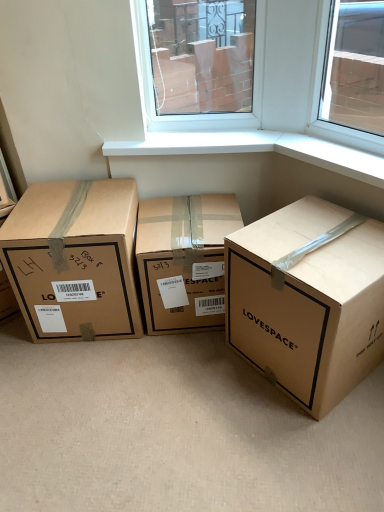
The width and height of the screenshot is (384, 512). Identify the location of brown cardboard box at center, acting as the first box starting from the right. (307, 302).

Describe the element at coordinates (184, 260) in the screenshot. I see `brown cardboard box at center, which is counted as the 2th box, starting from the left` at that location.

Image resolution: width=384 pixels, height=512 pixels. What are the coordinates of `brown cardboard box at left, acting as the first box starting from the left` in the screenshot? It's located at (74, 259).

Is brown cardboard box at center, acting as the first box starting from the right, at the back of brown cardboard box at left, marked as the third box in a right-to-left arrangement?

brown cardboard box at left, marked as the third box in a right-to-left arrangement, does not have its back to brown cardboard box at center, acting as the first box starting from the right.

How much distance is there between brown cardboard box at left, marked as the third box in a right-to-left arrangement, and brown cardboard box at center, which is the third box in left-to-right order?

brown cardboard box at left, marked as the third box in a right-to-left arrangement, is 25.31 inches away from brown cardboard box at center, which is the third box in left-to-right order.

I want to click on box that is above the brown cardboard box at center, acting as the first box starting from the right (from a real-world perspective), so click(74, 259).

From a real-world perspective, is brown cardboard box at left, marked as the third box in a right-to-left arrangement, on top of brown cardboard box at center, which is the third box in left-to-right order?

Yes, from a real-world perspective, brown cardboard box at left, marked as the third box in a right-to-left arrangement, is on top of brown cardboard box at center, which is the third box in left-to-right order.

In the image, is brown cardboard box at left, marked as the third box in a right-to-left arrangement, on the left side or the right side of brown cardboard box at center, the 2th box from the right?

In the image, brown cardboard box at left, marked as the third box in a right-to-left arrangement, appears on the left side of brown cardboard box at center, the 2th box from the right.

Looking at this image, is brown cardboard box at left, acting as the first box starting from the left, outside of brown cardboard box at center, the 2th box from the right?

brown cardboard box at left, acting as the first box starting from the left, is positioned outside brown cardboard box at center, the 2th box from the right.

Can you confirm if brown cardboard box at left, acting as the first box starting from the left, is bigger than brown cardboard box at center, which is counted as the 2th box, starting from the left?

Yes, brown cardboard box at left, acting as the first box starting from the left, is bigger than brown cardboard box at center, which is counted as the 2th box, starting from the left.

Considering the relative sizes of brown cardboard box at center, which is the third box in left-to-right order, and brown cardboard box at left, marked as the third box in a right-to-left arrangement, in the image provided, is brown cardboard box at center, which is the third box in left-to-right order, shorter than brown cardboard box at left, marked as the third box in a right-to-left arrangement,?

Yes, brown cardboard box at center, which is the third box in left-to-right order, is shorter than brown cardboard box at left, marked as the third box in a right-to-left arrangement.

Which object is closer to the camera, brown cardboard box at center, which is the third box in left-to-right order, or brown cardboard box at left, acting as the first box starting from the left?

brown cardboard box at center, which is the third box in left-to-right order, is more forward.

Is brown cardboard box at center, acting as the first box starting from the right, facing away from brown cardboard box at left, acting as the first box starting from the left?

No, brown cardboard box at center, acting as the first box starting from the right, is not facing away from brown cardboard box at left, acting as the first box starting from the left.

In terms of size, does brown cardboard box at center, which is the third box in left-to-right order, appear bigger or smaller than brown cardboard box at left, acting as the first box starting from the left?

Considering their sizes, brown cardboard box at center, which is the third box in left-to-right order, takes up more space than brown cardboard box at left, acting as the first box starting from the left.

How distant is brown cardboard box at center, which is counted as the 2th box, starting from the left, from brown cardboard box at center, acting as the first box starting from the right?

They are 12.55 inches apart.

Based on the photo, can you confirm if brown cardboard box at center, the 2th box from the right, is bigger than brown cardboard box at center, acting as the first box starting from the right?

No, brown cardboard box at center, the 2th box from the right, is not bigger than brown cardboard box at center, acting as the first box starting from the right.

Is brown cardboard box at center, the 2th box from the right, inside the boundaries of brown cardboard box at center, acting as the first box starting from the right, or outside?

The correct answer is: outside.

Does point (169, 326) come closer to viewer compared to point (250, 237)?

No.

Is brown cardboard box at center, which is counted as the 2th box, starting from the left, located within brown cardboard box at center, acting as the first box starting from the right?

No, brown cardboard box at center, acting as the first box starting from the right, does not contain brown cardboard box at center, which is counted as the 2th box, starting from the left.

Is brown cardboard box at center, which is the third box in left-to-right order, looking in the opposite direction of brown cardboard box at center, the 2th box from the right?

No, brown cardboard box at center, which is the third box in left-to-right order, is not facing away from brown cardboard box at center, the 2th box from the right.

Are brown cardboard box at center, acting as the first box starting from the right, and brown cardboard box at center, the 2th box from the right, located far from each other?

No, brown cardboard box at center, acting as the first box starting from the right, is in close proximity to brown cardboard box at center, the 2th box from the right.

In the image, is brown cardboard box at center, which is the third box in left-to-right order, positioned in front of or behind brown cardboard box at center, which is counted as the 2th box, starting from the left?

brown cardboard box at center, which is the third box in left-to-right order, is in front of brown cardboard box at center, which is counted as the 2th box, starting from the left.

From the image's perspective, which object appears higher, brown cardboard box at center, the 2th box from the right, or brown cardboard box at left, marked as the third box in a right-to-left arrangement?

brown cardboard box at left, marked as the third box in a right-to-left arrangement, appears higher in the image.

From a real-world perspective, is brown cardboard box at center, which is counted as the 2th box, starting from the left, below brown cardboard box at left, marked as the third box in a right-to-left arrangement?

Yes, from a real-world perspective, brown cardboard box at center, which is counted as the 2th box, starting from the left, is under brown cardboard box at left, marked as the third box in a right-to-left arrangement.

Is brown cardboard box at center, which is counted as the 2th box, starting from the left, positioned with its back to brown cardboard box at left, marked as the third box in a right-to-left arrangement?

No, brown cardboard box at left, marked as the third box in a right-to-left arrangement, is not at the back of brown cardboard box at center, which is counted as the 2th box, starting from the left.

Considering the sizes of objects brown cardboard box at center, the 2th box from the right, and brown cardboard box at left, marked as the third box in a right-to-left arrangement, in the image provided, who is shorter, brown cardboard box at center, the 2th box from the right, or brown cardboard box at left, marked as the third box in a right-to-left arrangement,?

brown cardboard box at center, the 2th box from the right.

Identify the location of box in front of the brown cardboard box at left, acting as the first box starting from the left. (307, 302).

Image resolution: width=384 pixels, height=512 pixels. Identify the location of box that is the 1st object to the right of the brown cardboard box at left, marked as the third box in a right-to-left arrangement, starting at the anchor. (184, 260).

Which object lies further to the anchor point brown cardboard box at center, which is counted as the 2th box, starting from the left, brown cardboard box at left, acting as the first box starting from the left, or brown cardboard box at center, which is the third box in left-to-right order?

Among the two, brown cardboard box at center, which is the third box in left-to-right order, is located further to brown cardboard box at center, which is counted as the 2th box, starting from the left.

Looking at the image, which one is located closer to brown cardboard box at left, acting as the first box starting from the left, brown cardboard box at center, acting as the first box starting from the right, or brown cardboard box at center, the 2th box from the right?

brown cardboard box at center, the 2th box from the right, lies closer to brown cardboard box at left, acting as the first box starting from the left, than the other object.

Looking at the image, which one is located closer to brown cardboard box at center, which is counted as the 2th box, starting from the left, brown cardboard box at center, acting as the first box starting from the right, or brown cardboard box at left, acting as the first box starting from the left?

The object closer to brown cardboard box at center, which is counted as the 2th box, starting from the left, is brown cardboard box at left, acting as the first box starting from the left.

Looking at this image, from the image, which object appears to be nearer to brown cardboard box at center, which is the third box in left-to-right order, brown cardboard box at left, acting as the first box starting from the left, or brown cardboard box at center, which is counted as the 2th box, starting from the left?

brown cardboard box at center, which is counted as the 2th box, starting from the left.

Which object lies nearer to the anchor point brown cardboard box at left, marked as the third box in a right-to-left arrangement, brown cardboard box at center, which is counted as the 2th box, starting from the left, or brown cardboard box at center, acting as the first box starting from the right?

The object closer to brown cardboard box at left, marked as the third box in a right-to-left arrangement, is brown cardboard box at center, which is counted as the 2th box, starting from the left.

When comparing their distances from brown cardboard box at center, acting as the first box starting from the right, does brown cardboard box at center, which is counted as the 2th box, starting from the left, or brown cardboard box at left, marked as the third box in a right-to-left arrangement, seem further?

Based on the image, brown cardboard box at left, marked as the third box in a right-to-left arrangement, appears to be further to brown cardboard box at center, acting as the first box starting from the right.

Where is `box between brown cardboard box at left, acting as the first box starting from the left, and brown cardboard box at center, which is the third box in left-to-right order`? This screenshot has height=512, width=384. box between brown cardboard box at left, acting as the first box starting from the left, and brown cardboard box at center, which is the third box in left-to-right order is located at coordinates (184, 260).